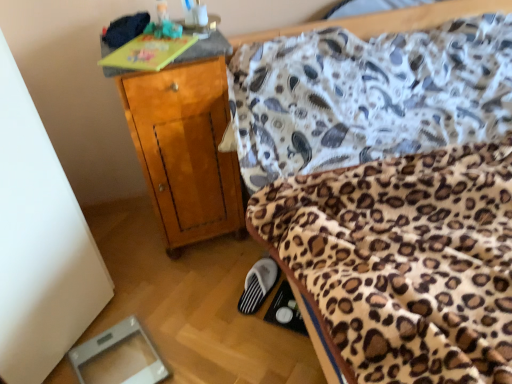
Image resolution: width=512 pixels, height=384 pixels. Identify the location of free point in front of wooden nightstand at upper left. (190, 297).